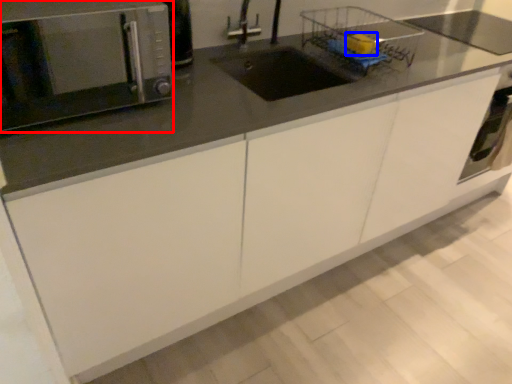
Question: Among these objects, which one is nearest to the camera, microwave oven (highlighted by a red box) or food (highlighted by a blue box)?

Choices:
 (A) microwave oven
 (B) food

Answer: (A)